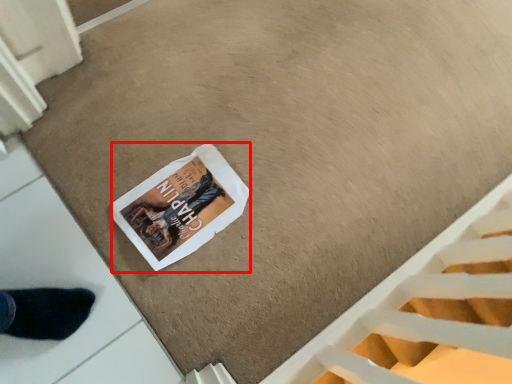
Question: In this image, where is magazine (annotated by the red box) located relative to stairwell?

Choices:
 (A) right
 (B) left

Answer: (B)